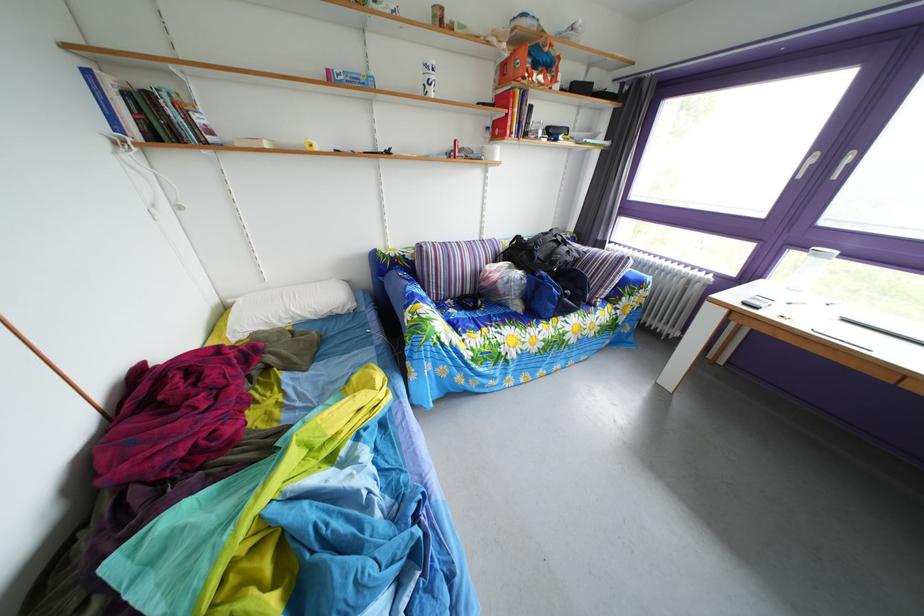
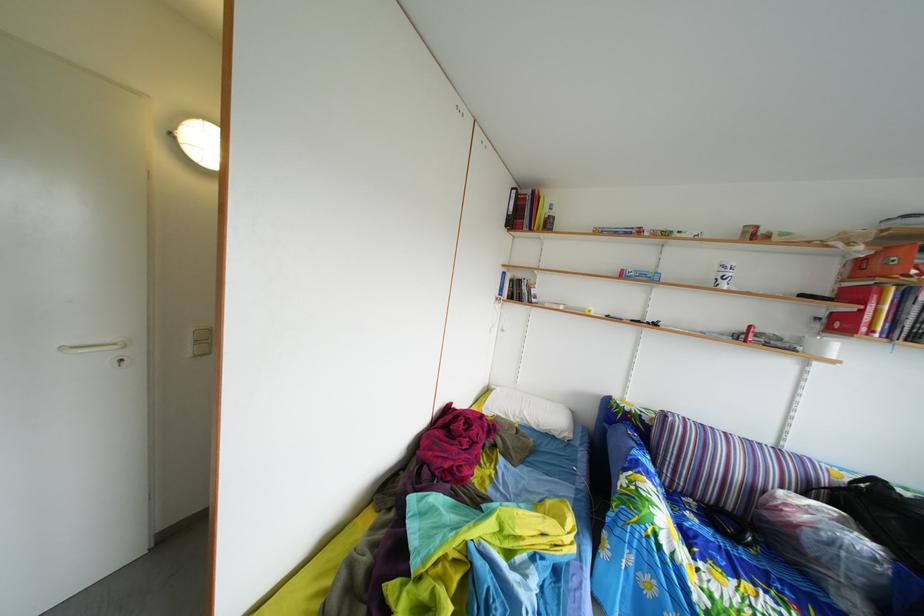
In the second image, find the point that corresponds to point (479, 300) in the first image.

(739, 516)